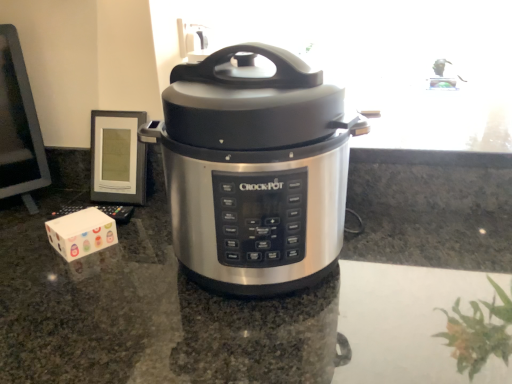
Question: Considering the relative positions of stainless steel slow cooker at center and white cardboard box at lower left in the image provided, is stainless steel slow cooker at center to the right of white cardboard box at lower left from the viewer's perspective?

Choices:
 (A) yes
 (B) no

Answer: (A)

Question: Would you say white cardboard box at lower left is part of stainless steel slow cooker at center's contents?

Choices:
 (A) no
 (B) yes

Answer: (A)

Question: Is stainless steel slow cooker at center not close to white cardboard box at lower left?

Choices:
 (A) yes
 (B) no

Answer: (B)

Question: Is stainless steel slow cooker at center outside of white cardboard box at lower left?

Choices:
 (A) no
 (B) yes

Answer: (B)

Question: Is stainless steel slow cooker at center positioned in front of white cardboard box at lower left?

Choices:
 (A) no
 (B) yes

Answer: (B)

Question: Considering the positions of stainless steel countertop at center and white cardboard box at lower left in the image, is stainless steel countertop at center wider or thinner than white cardboard box at lower left?

Choices:
 (A) wide
 (B) thin

Answer: (A)

Question: Does point (463, 173) appear closer or farther from the camera than point (74, 218)?

Choices:
 (A) farther
 (B) closer

Answer: (A)

Question: From the image's perspective, is stainless steel countertop at center above or below white cardboard box at lower left?

Choices:
 (A) above
 (B) below

Answer: (B)

Question: From a real-world perspective, relative to white cardboard box at lower left, is stainless steel countertop at center vertically above or below?

Choices:
 (A) below
 (B) above

Answer: (A)

Question: Considering the positions of stainless steel countertop at center and stainless steel slow cooker at center in the image, is stainless steel countertop at center bigger or smaller than stainless steel slow cooker at center?

Choices:
 (A) small
 (B) big

Answer: (B)

Question: From a real-world perspective, is stainless steel countertop at center above or below stainless steel slow cooker at center?

Choices:
 (A) below
 (B) above

Answer: (A)

Question: From the image's perspective, is stainless steel countertop at center located above or below stainless steel slow cooker at center?

Choices:
 (A) above
 (B) below

Answer: (B)

Question: Considering the relative positions of stainless steel countertop at center and stainless steel slow cooker at center in the image provided, is stainless steel countertop at center to the left or to the right of stainless steel slow cooker at center?

Choices:
 (A) left
 (B) right

Answer: (B)

Question: From the image's perspective, relative to white cardboard box at lower left, is stainless steel slow cooker at center above or below?

Choices:
 (A) below
 (B) above

Answer: (B)

Question: From a real-world perspective, is stainless steel slow cooker at center above or below white cardboard box at lower left?

Choices:
 (A) above
 (B) below

Answer: (A)